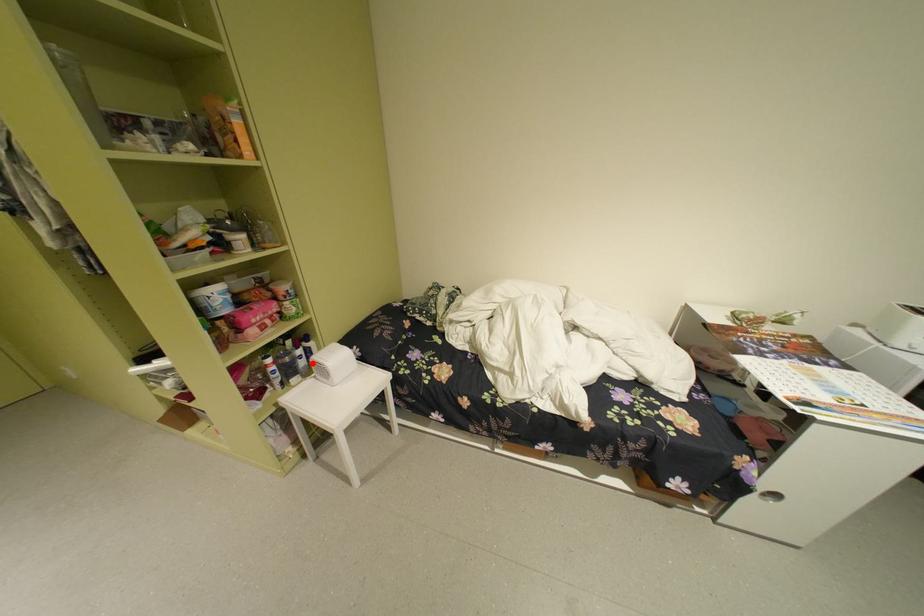
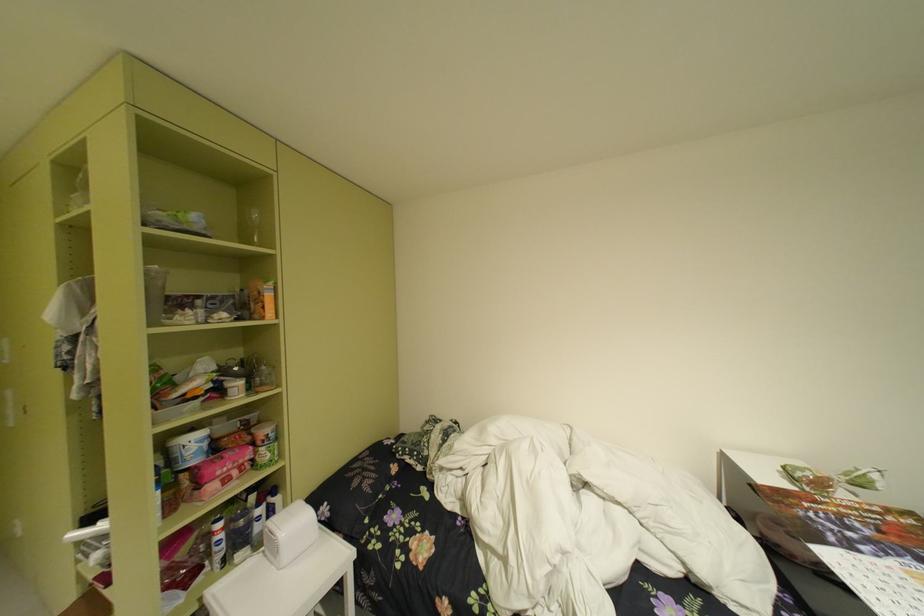
Where in the second image is the point corresponding to the highlighted location from the first image?

(269, 528)